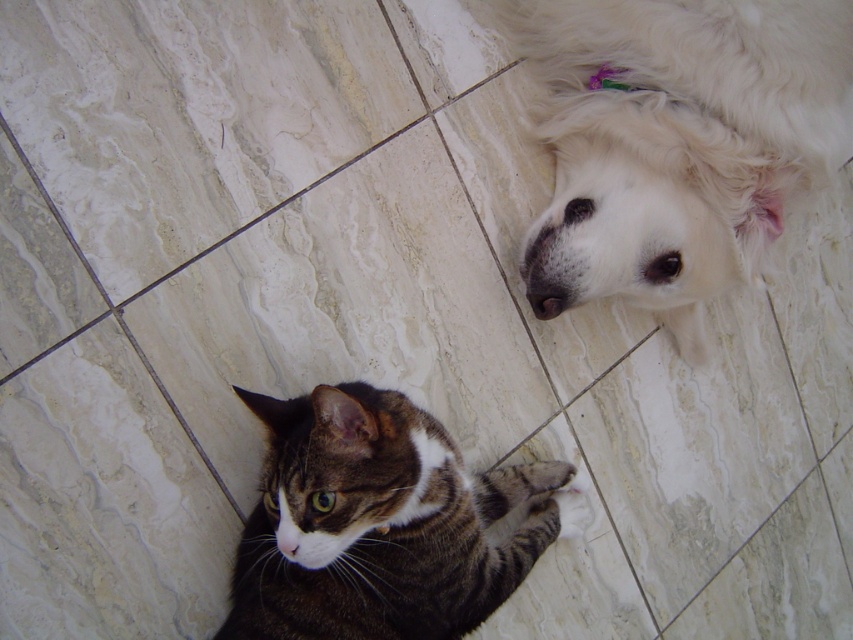
Consider the image. Please provide the coordinates of the white fluffy dog at upper right in the image. The coordinates should be in the format of a point with two decimal places, like this example format point 0.22, 0.79. The scene is a tiled floor with a cat and a dog. The dog is white and fluffy, located at the upper right of the image.

The white fluffy dog at upper right is located at point [682,140].

You are standing at the camera position and see two points marked on the tiled floor. The first point is at coordinate point(732, 244) and the second is at point(471, 596). Which point is closer to you?

Point(471, 596) is closer to you because it is in front of point(732, 244).